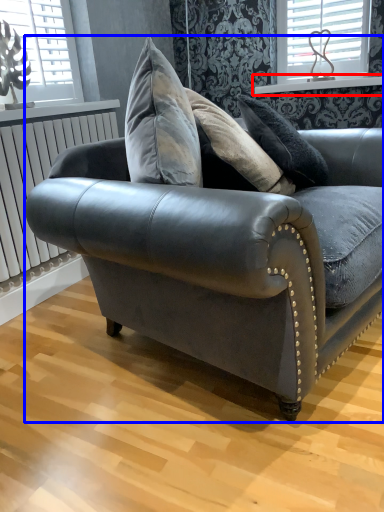
Question: Which point is closer to the camera, window sill (highlighted by a red box) or studio couch (highlighted by a blue box)?

Choices:
 (A) window sill
 (B) studio couch

Answer: (B)